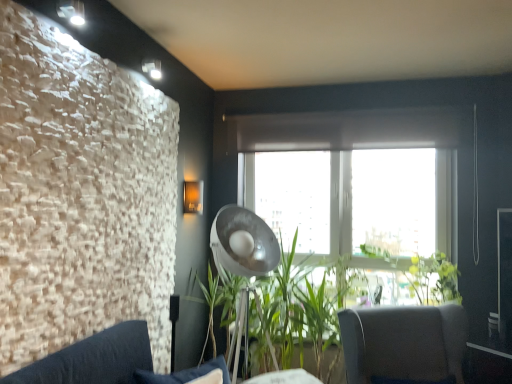
Question: In terms of height, does metallic silver lamp at center look taller or shorter compared to dark gray fabric couch at lower left?

Choices:
 (A) short
 (B) tall

Answer: (B)

Question: Is metallic silver lamp at center bigger or smaller than dark gray fabric couch at lower left?

Choices:
 (A) big
 (B) small

Answer: (A)

Question: Which is nearer to the green leafy plant at center?

Choices:
 (A) dark gray fabric couch at lower left
 (B) green leafy plant at center
 (C) dark gray fabric chair at lower right
 (D) metallic silver lamp at center

Answer: (C)

Question: Estimate the real-world distances between objects in this image. Which object is closer to the dark gray fabric couch at lower left?

Choices:
 (A) dark gray fabric chair at lower right
 (B) green leafy plant at center
 (C) green leafy plant at center
 (D) metallic silver lamp at center

Answer: (D)